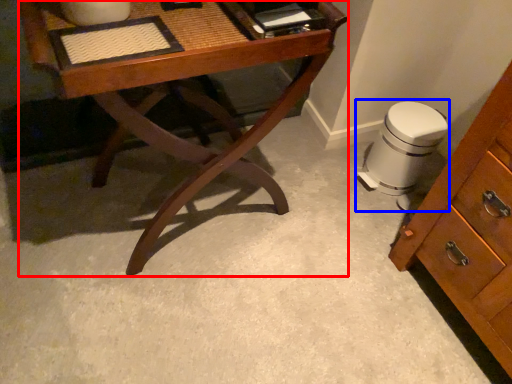
Question: Among these objects, which one is nearest to the camera, desk (highlighted by a red box) or swivel chair (highlighted by a blue box)?

Choices:
 (A) desk
 (B) swivel chair

Answer: (A)